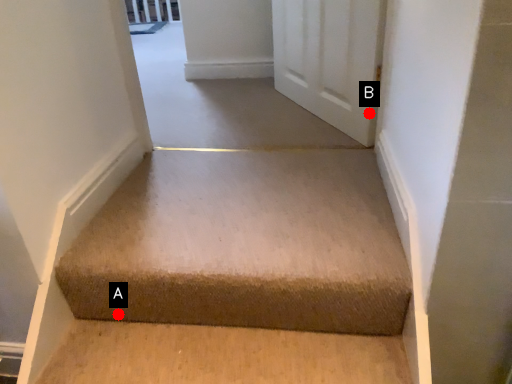
Question: Two points are circled on the image, labeled by A and B beside each circle. Which point is closer to the camera taking this photo?

Choices:
 (A) A is closer
 (B) B is closer

Answer: (A)